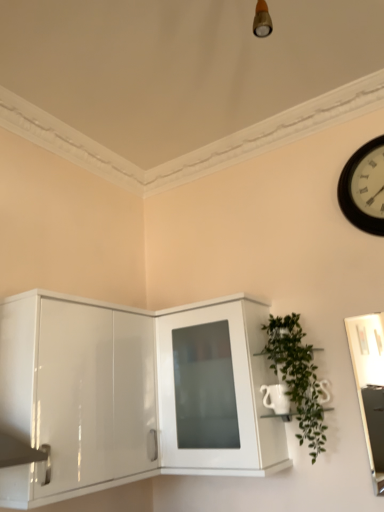
Question: From a real-world perspective, does black wooden clock at upper right stand above green leafy plant at right?

Choices:
 (A) yes
 (B) no

Answer: (A)

Question: Considering the relative positions of black wooden clock at upper right and green leafy plant at right in the image provided, is black wooden clock at upper right to the right of green leafy plant at right from the viewer's perspective?

Choices:
 (A) yes
 (B) no

Answer: (A)

Question: Considering the relative positions of black wooden clock at upper right and green leafy plant at right in the image provided, is black wooden clock at upper right behind green leafy plant at right?

Choices:
 (A) no
 (B) yes

Answer: (B)

Question: Is black wooden clock at upper right to the left of green leafy plant at right from the viewer's perspective?

Choices:
 (A) yes
 (B) no

Answer: (B)

Question: From the image's perspective, is black wooden clock at upper right over green leafy plant at right?

Choices:
 (A) yes
 (B) no

Answer: (A)

Question: Does point (372, 200) appear closer or farther from the camera than point (248, 323)?

Choices:
 (A) closer
 (B) farther

Answer: (A)

Question: Is black wooden clock at upper right wider or thinner than glossy white cabinet at lower left, the 1th cabinetry in the left-to-right sequence?

Choices:
 (A) thin
 (B) wide

Answer: (A)

Question: Based on their positions, is black wooden clock at upper right located to the left or right of glossy white cabinet at lower left, the 1th cabinetry in the left-to-right sequence?

Choices:
 (A) right
 (B) left

Answer: (A)

Question: From their relative heights in the image, would you say black wooden clock at upper right is taller or shorter than glossy white cabinet at lower left, the 1th cabinetry in the left-to-right sequence?

Choices:
 (A) short
 (B) tall

Answer: (A)

Question: Based on their positions, is black wooden clock at upper right located to the left or right of white glossy cabinet at center, which is the second cabinetry in left-to-right order?

Choices:
 (A) right
 (B) left

Answer: (A)

Question: In the image, is black wooden clock at upper right positioned in front of or behind white glossy cabinet at center, which is the second cabinetry in left-to-right order?

Choices:
 (A) behind
 (B) front

Answer: (A)

Question: From the image's perspective, is black wooden clock at upper right positioned above or below white glossy cabinet at center, which is the second cabinetry in left-to-right order?

Choices:
 (A) below
 (B) above

Answer: (B)

Question: From a real-world perspective, relative to white glossy cabinet at center, which is the 1th cabinetry from right to left, is black wooden clock at upper right vertically above or below?

Choices:
 (A) above
 (B) below

Answer: (A)

Question: Is glossy white cabinet at lower left, positioned as the second cabinetry in right-to-left order, to the left or to the right of green leafy plant at right in the image?

Choices:
 (A) right
 (B) left

Answer: (B)

Question: Considering the positions of glossy white cabinet at lower left, positioned as the second cabinetry in right-to-left order, and green leafy plant at right in the image, is glossy white cabinet at lower left, positioned as the second cabinetry in right-to-left order, bigger or smaller than green leafy plant at right?

Choices:
 (A) big
 (B) small

Answer: (A)